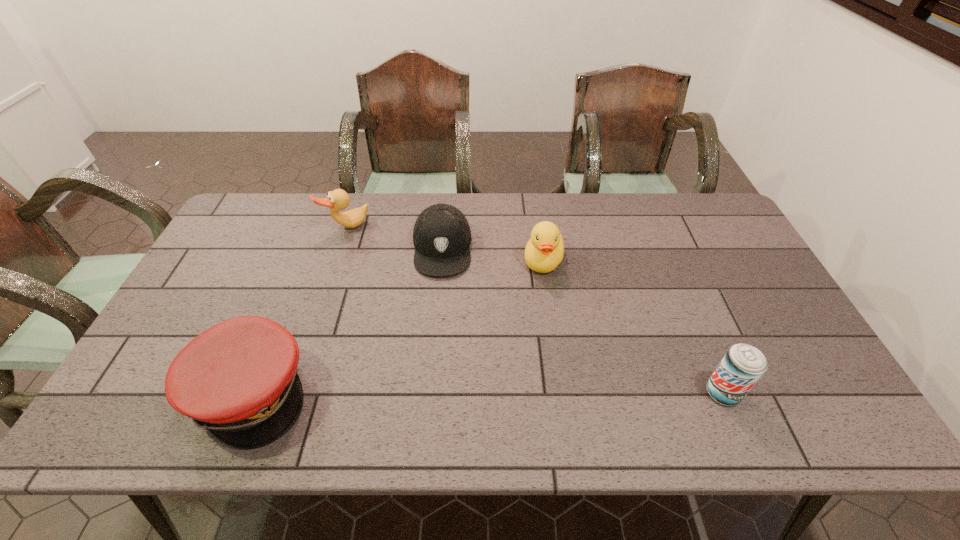
Point out which object is positioned as the fourth nearest to the right cap. Please provide its 2D coordinates. Your answer should be formatted as a tuple, i.e. [(x, y)], where the tuple contains the x and y coordinates of a point satisfying the conditions above.

[(743, 365)]

You are a GUI agent. You are given a task and a screenshot of the screen. Output one action in this format:
    pyautogui.click(x=<x>, y=<y>)
    Task: Click on the object that stands as the second closest to the nearer duck
    
    Given the screenshot: What is the action you would take?
    pyautogui.click(x=743, y=365)

Find the location of a particular element. free location that satisfies the following two spatial constraints: 1. on the front side of the right cap; 2. on the right side of the beer can is located at coordinates (429, 393).